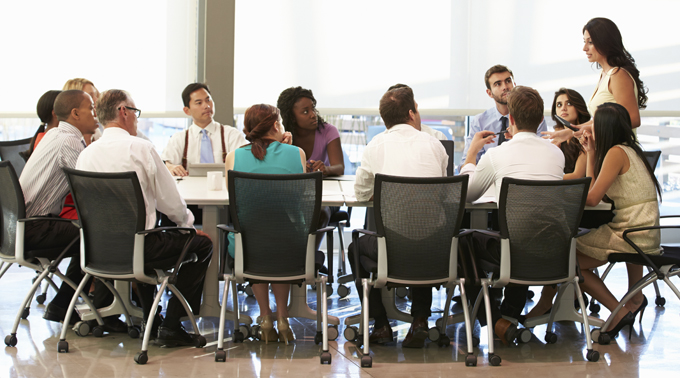
I want to click on chairs, so click(x=662, y=266), click(x=658, y=158), click(x=539, y=209), click(x=424, y=210), click(x=454, y=144), click(x=279, y=210), click(x=105, y=201), click(x=14, y=198), click(x=24, y=140).